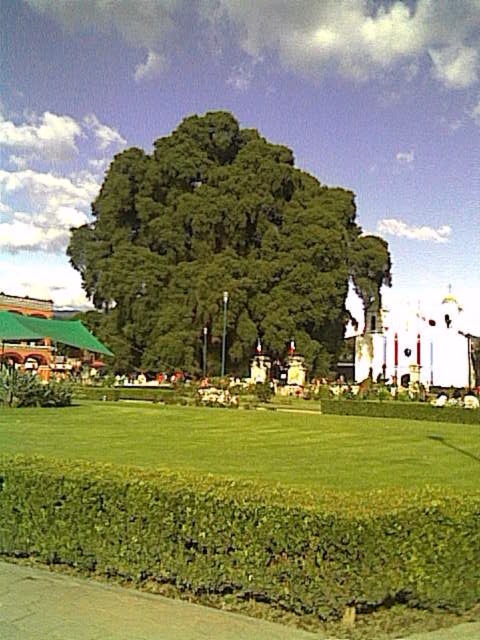
Does green leafy tree at center have a smaller size compared to green grass at lower center?

No.

Does point (229, 212) lie in front of point (31, 442)?

No, (229, 212) is further to viewer.

Locate an element on the screen. green leafy tree at center is located at coordinates (225, 252).

Looking at this image, between green leafy hedge at lower center and green grass at lower center, which one is positioned higher?

green leafy hedge at lower center is above.

This screenshot has width=480, height=640. Find the location of `green leafy hedge at lower center`. green leafy hedge at lower center is located at coordinates (245, 536).

In order to click on green leafy hedge at lower center in this screenshot , I will do `click(245, 536)`.

Does point (111, 292) lie behind point (74, 472)?

That is True.

Can you confirm if green leafy tree at center is positioned to the left of green leafy hedge at lower center?

Yes, green leafy tree at center is to the left of green leafy hedge at lower center.

What do you see at coordinates (225, 252) in the screenshot? I see `green leafy tree at center` at bounding box center [225, 252].

Locate an element on the screen. green leafy tree at center is located at coordinates (225, 252).